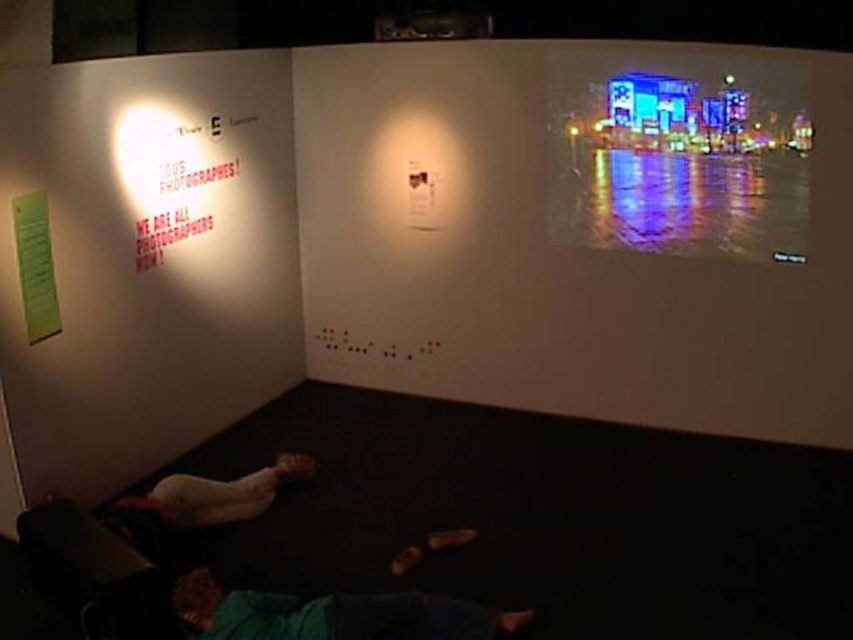
Can you confirm if reflective glass cityscape at upper right is positioned to the left of green fabric pants at lower center?

In fact, reflective glass cityscape at upper right is to the right of green fabric pants at lower center.

This screenshot has width=853, height=640. Identify the location of reflective glass cityscape at upper right. (679, 154).

Is point (677, 141) positioned in front of point (469, 636)?

No, it is not.

The height and width of the screenshot is (640, 853). I want to click on reflective glass cityscape at upper right, so click(679, 154).

Is point (137, 513) more distant than point (25, 321)?

Yes.

Does smooth skin person at lower center appear under green paper at left?

Correct, smooth skin person at lower center is located below green paper at left.

The width and height of the screenshot is (853, 640). What do you see at coordinates (206, 497) in the screenshot?
I see `smooth skin person at lower center` at bounding box center [206, 497].

The width and height of the screenshot is (853, 640). What are the coordinates of `smooth skin person at lower center` in the screenshot? It's located at click(206, 497).

Who is more distant from viewer, (196, 588) or (38, 260)?

The point (38, 260) is behind.

Does point (281, 596) lie behind point (42, 241)?

That is False.

Identify the location of green fabric pants at lower center. (334, 614).